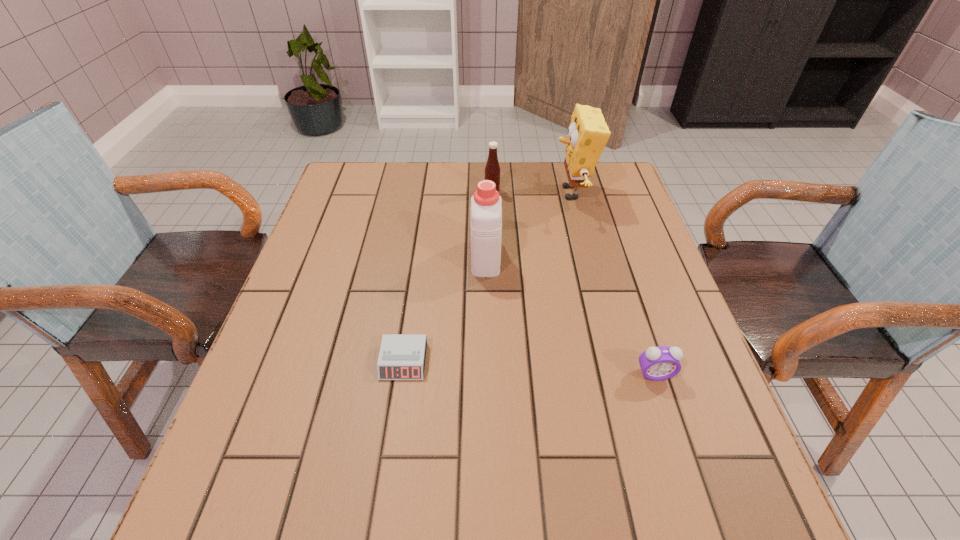
The height and width of the screenshot is (540, 960). I want to click on object that is at the far right corner, so click(588, 133).

Locate an element on the screen. free space at the far edge of the desktop is located at coordinates (426, 171).

Where is `free spot at the near edge of the desktop`? Image resolution: width=960 pixels, height=540 pixels. free spot at the near edge of the desktop is located at coordinates (468, 518).

Locate an element on the screen. The image size is (960, 540). vacant space at the left edge of the desktop is located at coordinates (316, 261).

Locate an element on the screen. The image size is (960, 540). vacant space at the right edge is located at coordinates (618, 230).

Identify the location of empty space that is in between the sponge and the fourth tallest object. (613, 284).

At what (x,y) coordinates should I click in order to perform the action: click on free spot between the third shortest object and the taller alarm clock. Please return your answer as a coordinate pair (x, y). Looking at the image, I should click on (573, 282).

The height and width of the screenshot is (540, 960). Identify the location of vacant area that lies between the third tallest object and the leftmost object. (448, 276).

Find the location of a particular element. This screenshot has width=960, height=540. vacant area that lies between the left alarm clock and the sponge is located at coordinates (488, 277).

This screenshot has height=540, width=960. Find the location of `free space between the shortest object and the detergent`. free space between the shortest object and the detergent is located at coordinates (444, 309).